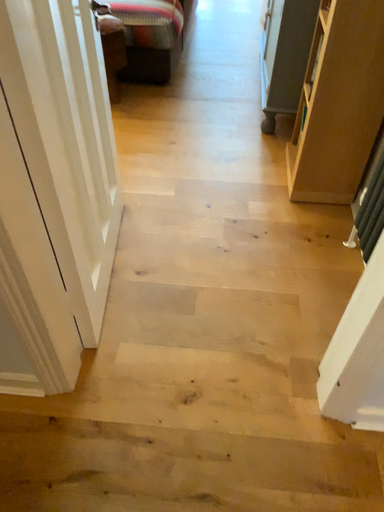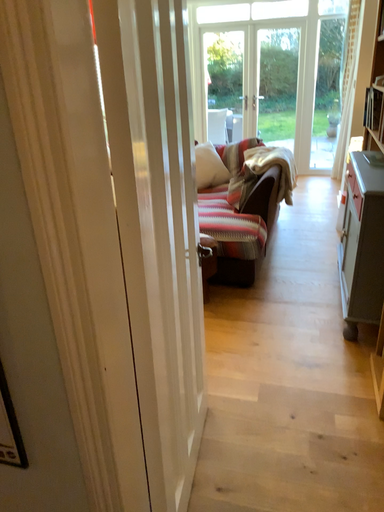
Question: How did the camera likely rotate when shooting the video?

Choices:
 (A) rotated right
 (B) rotated left

Answer: (B)